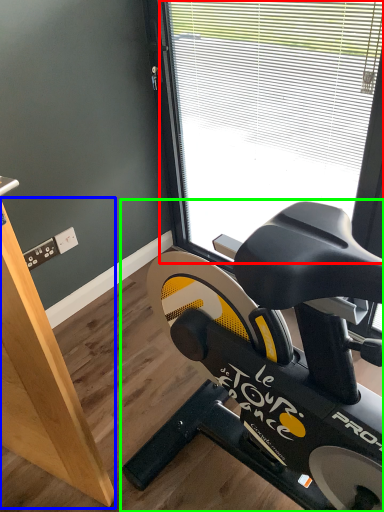
Question: Estimate the real-world distances between objects in this image. Which object is closer to window (highlighted by a red box), plywood (highlighted by a blue box) or stationary bicycle (highlighted by a green box)?

Choices:
 (A) plywood
 (B) stationary bicycle

Answer: (B)